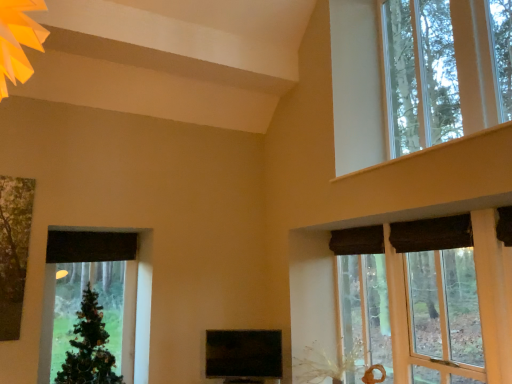
Question: Does green matte christmas tree at left appear on the left side of wooden window frame at upper right, which ranks as the 1th window in bottom-to-top order?

Choices:
 (A) no
 (B) yes

Answer: (B)

Question: Is wooden window frame at upper right, which ranks as the 1th window in bottom-to-top order, a part of green matte christmas tree at left?

Choices:
 (A) no
 (B) yes

Answer: (A)

Question: Is wooden window frame at upper right, which is counted as the 2th window, starting from the top, at the back of green matte christmas tree at left?

Choices:
 (A) yes
 (B) no

Answer: (B)

Question: Does green matte christmas tree at left have a larger size compared to wooden window frame at upper right, which is counted as the 2th window, starting from the top?

Choices:
 (A) no
 (B) yes

Answer: (A)

Question: Does green matte christmas tree at left appear on the right side of wooden window frame at upper right, which is counted as the 2th window, starting from the top?

Choices:
 (A) no
 (B) yes

Answer: (A)

Question: From the image's perspective, is green matte christmas tree at left beneath wooden window frame at upper right, which is counted as the 2th window, starting from the top?

Choices:
 (A) yes
 (B) no

Answer: (A)

Question: From the image's perspective, is clear glass window at upper right, the first window when ordered from top to bottom, under wooden window frame at upper right, which is counted as the 2th window, starting from the top?

Choices:
 (A) no
 (B) yes

Answer: (A)

Question: Is wooden window frame at upper right, which is counted as the 2th window, starting from the top, surrounded by clear glass window at upper right, the first window when ordered from top to bottom?

Choices:
 (A) yes
 (B) no

Answer: (B)

Question: Considering the relative positions of clear glass window at upper right, placed as the 2th window when sorted from bottom to top, and wooden window frame at upper right, which is counted as the 2th window, starting from the top, in the image provided, is clear glass window at upper right, placed as the 2th window when sorted from bottom to top, to the right of wooden window frame at upper right, which is counted as the 2th window, starting from the top, from the viewer's perspective?

Choices:
 (A) yes
 (B) no

Answer: (A)

Question: Is clear glass window at upper right, the first window when ordered from top to bottom, shorter than wooden window frame at upper right, which is counted as the 2th window, starting from the top?

Choices:
 (A) no
 (B) yes

Answer: (A)

Question: Is clear glass window at upper right, placed as the 2th window when sorted from bottom to top, completely or partially outside of wooden window frame at upper right, which ranks as the 1th window in bottom-to-top order?

Choices:
 (A) yes
 (B) no

Answer: (A)

Question: Does clear glass window at upper right, placed as the 2th window when sorted from bottom to top, touch wooden window frame at upper right, which ranks as the 1th window in bottom-to-top order?

Choices:
 (A) no
 (B) yes

Answer: (A)

Question: Does green matte christmas tree at left have a lesser height compared to clear glass window at upper right, placed as the 2th window when sorted from bottom to top?

Choices:
 (A) no
 (B) yes

Answer: (B)